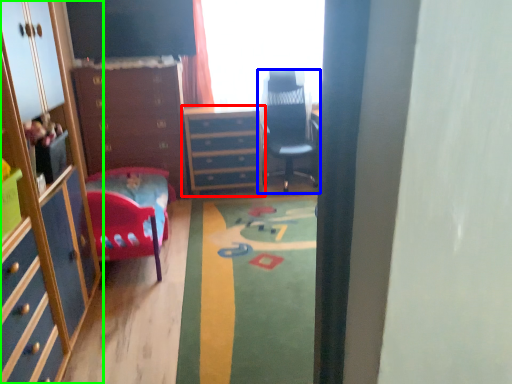
Question: Which is farther away from chest of drawers (highlighted by a red box)? chair (highlighted by a blue box) or cabinetry (highlighted by a green box)?

Choices:
 (A) chair
 (B) cabinetry

Answer: (B)